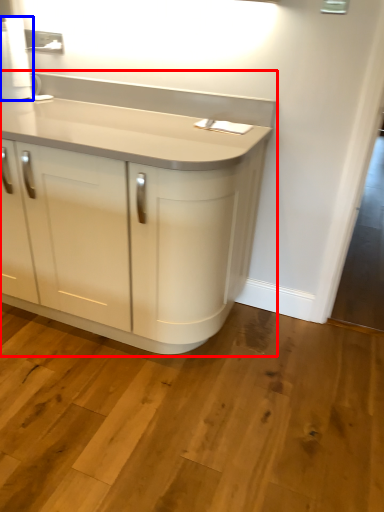
Question: Which point is further to the camera, cupboard (highlighted by a red box) or paper towel (highlighted by a blue box)?

Choices:
 (A) cupboard
 (B) paper towel

Answer: (B)